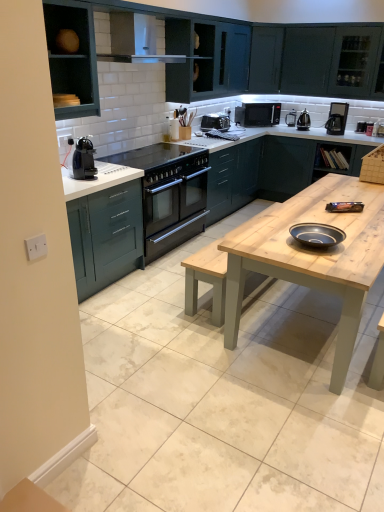
What are the coordinates of `vacant space that is to the left of black plastic coffee machine at left` in the screenshot? It's located at (71, 176).